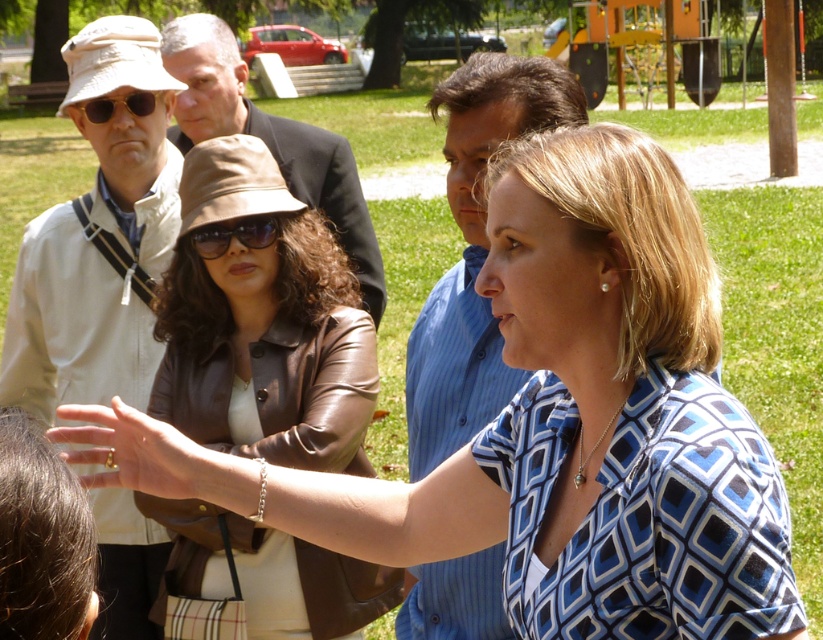
Question: Which object is the farthest from the blue striped shirt at center?

Choices:
 (A) brown leather jacket at upper center
 (B) light beige fabric hat at upper left

Answer: (B)

Question: Can you confirm if light beige fabric hat at upper left is positioned below blue striped shirt at center?

Choices:
 (A) no
 (B) yes

Answer: (B)

Question: Does dark brown suit at center come behind matte brown sunglasses at center?

Choices:
 (A) yes
 (B) no

Answer: (A)

Question: Can you confirm if matte brown sunglasses at center is positioned to the left of matte black sunglasses at upper left?

Choices:
 (A) yes
 (B) no

Answer: (B)

Question: Considering the real-world distances, which object is closest to the matte brown sunglasses at center?

Choices:
 (A) light beige fabric hat at upper left
 (B) blue striped shirt at center
 (C) matte black sunglasses at upper left
 (D) dark brown suit at center

Answer: (A)

Question: Which point is closer to the camera taking this photo?

Choices:
 (A) (463, 289)
 (B) (151, 508)
 (C) (100, 362)
 (D) (184, 19)

Answer: (A)